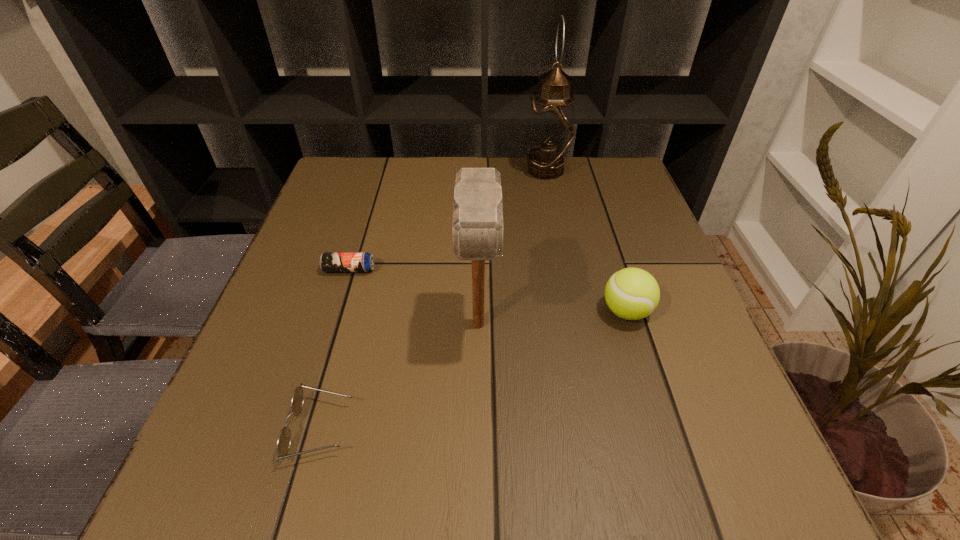
You are a GUI agent. You are given a task and a screenshot of the screen. Output one action in this format:
    pyautogui.click(x=<x>, y=<y>)
    Task: Click on the tallest object
    
    Given the screenshot: What is the action you would take?
    pyautogui.click(x=550, y=131)

What are the coordinates of `the farthest object` in the screenshot? It's located at (550, 131).

The height and width of the screenshot is (540, 960). What are the coordinates of `the third object from right to left` in the screenshot? It's located at (477, 227).

This screenshot has width=960, height=540. I want to click on mallet, so click(477, 227).

I want to click on tennis ball, so click(632, 293).

Find the location of `spectacles`. spectacles is located at coordinates [x=283, y=443].

Locate an element on the screen. The width and height of the screenshot is (960, 540). the second farthest object is located at coordinates (329, 261).

Where is `free space located on the left of the farthest object`? The height and width of the screenshot is (540, 960). free space located on the left of the farthest object is located at coordinates (498, 170).

This screenshot has width=960, height=540. I want to click on free space located 0.080m on the striking face of the third object from right to left, so click(x=478, y=397).

The image size is (960, 540). What are the coordinates of `free space located 0.140m on the left of the tennis ball` in the screenshot? It's located at (528, 312).